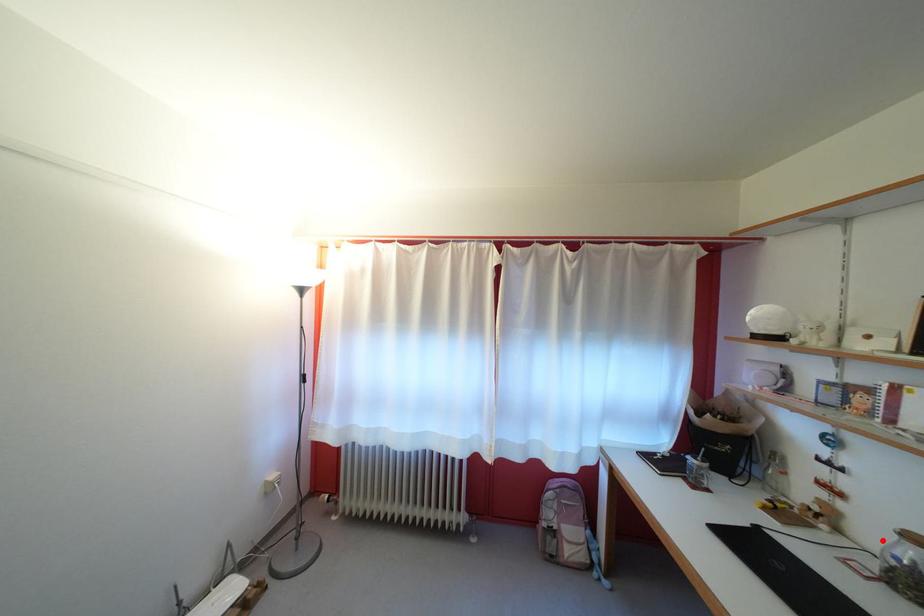
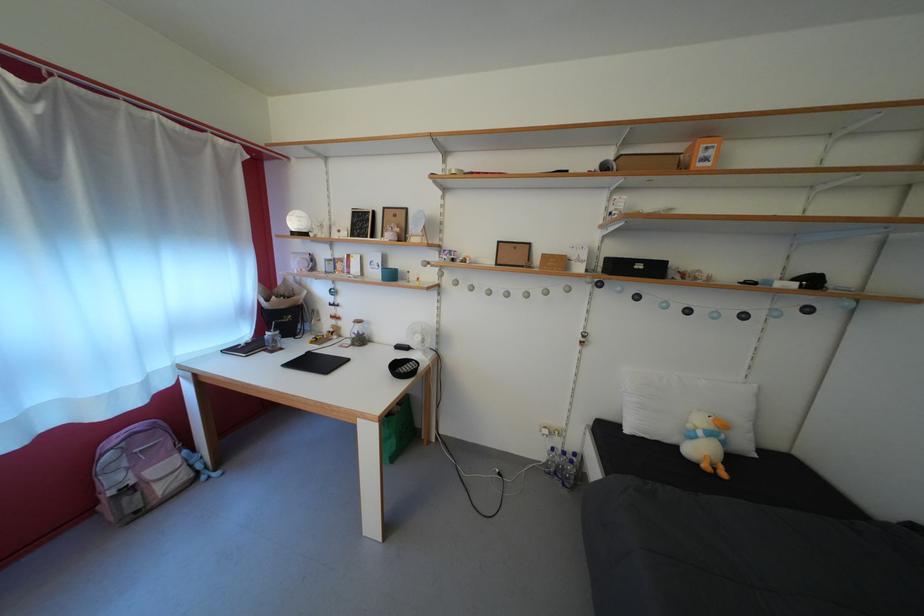
Question: I am providing you with two images of the same scene from different viewpoints. Given a red point in image1, look at the same physical point in image2. Is it:

Choices:
 (A) Closer to the viewpoint
 (B) Farther from the viewpoint

Answer: (B)